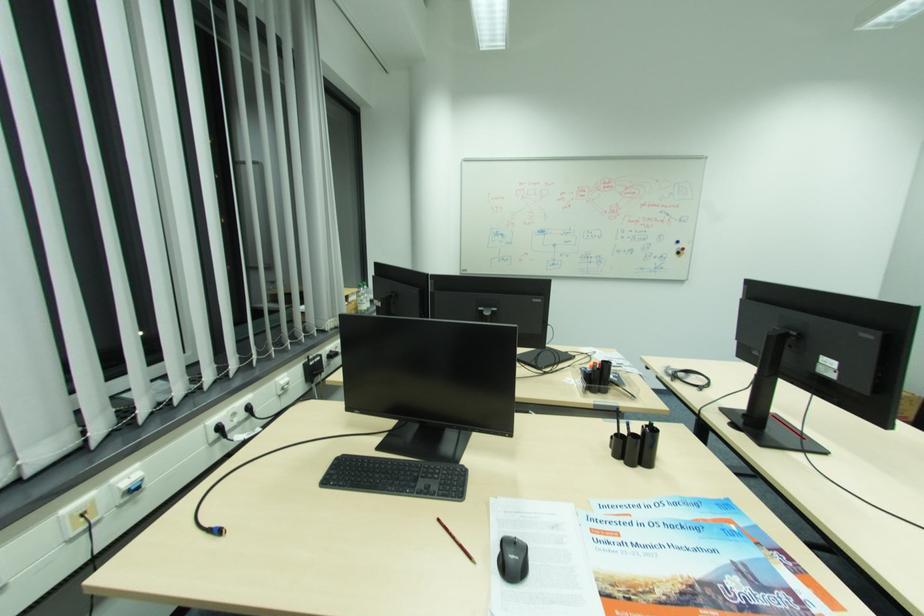
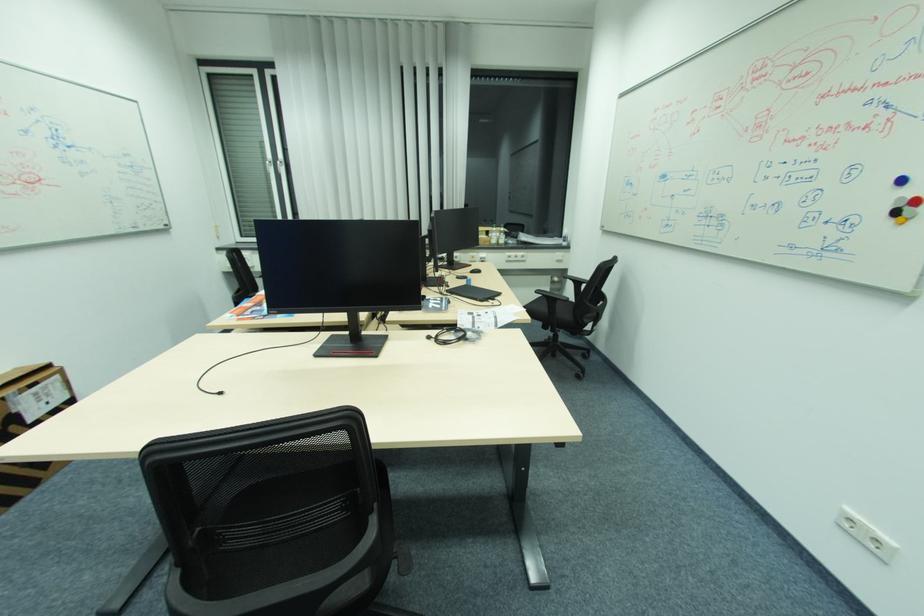
Question: I am providing you with two images of the same scene from different viewpoints. Please identify which objects are invisible in image2.

Choices:
 (A) white wall socket
 (B) black pen
 (C) blue tool handles
 (D) cardboard box

Answer: (B)